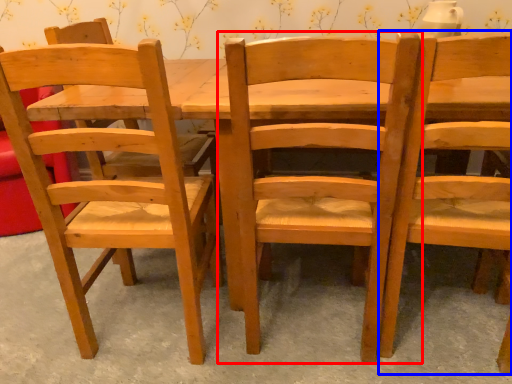
Question: Which object is further to the camera taking this photo, chair (highlighted by a red box) or chair (highlighted by a blue box)?

Choices:
 (A) chair
 (B) chair

Answer: (A)